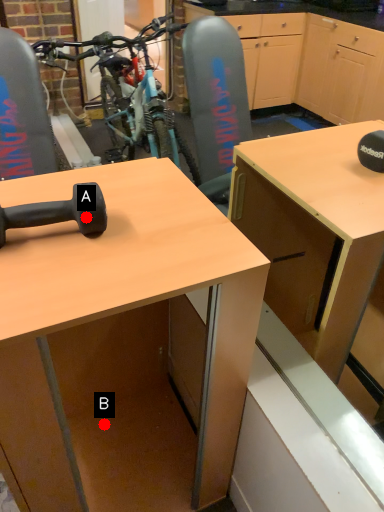
Question: Two points are circled on the image, labeled by A and B beside each circle. Which point is farther from the camera taking this photo?

Choices:
 (A) A is further
 (B) B is further

Answer: (B)